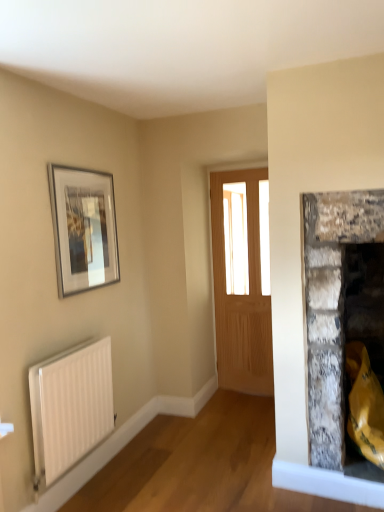
Identify the location of vacant space underneath white matte radiator at lower left (from a real-world perspective). (96, 482).